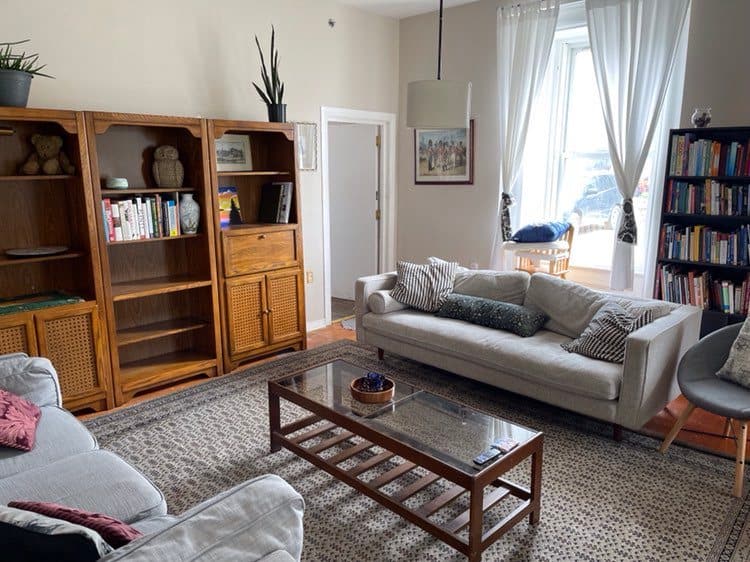
At what (x,y) coordinates should I click in order to perform the action: click on white curtains. Please return your answer as a coordinate pair (x, y). This screenshot has height=562, width=750. Looking at the image, I should click on (520, 72), (633, 67).